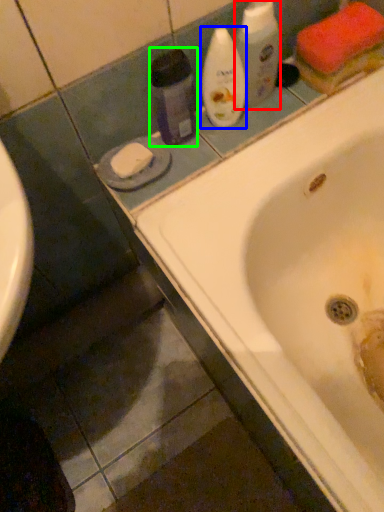
Question: Considering the real-world distances, which object is farthest from cleaning product (highlighted by a red box)? cleaning product (highlighted by a blue box) or cleaning product (highlighted by a green box)?

Choices:
 (A) cleaning product
 (B) cleaning product

Answer: (B)